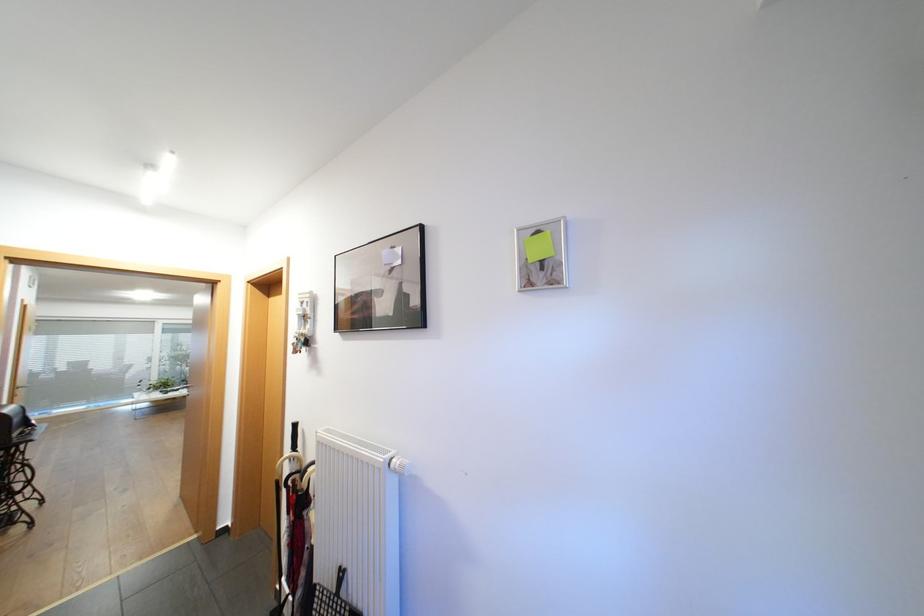
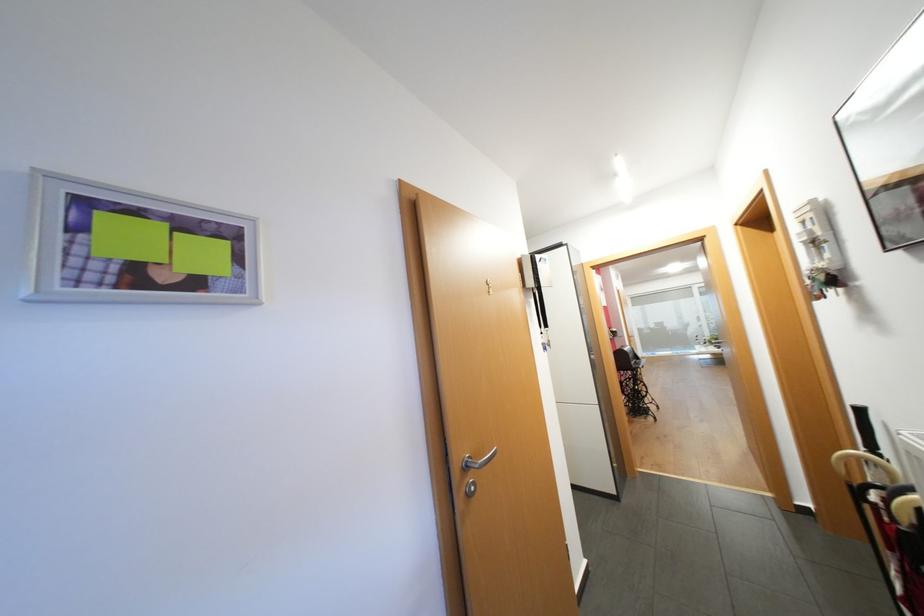
Question: The camera is either moving clockwise (left) or counter-clockwise (right) around the object. The first image is from the beginning of the video and the second image is from the end. Is the camera moving left or right when shooting the video?

Choices:
 (A) Left
 (B) Right

Answer: (B)